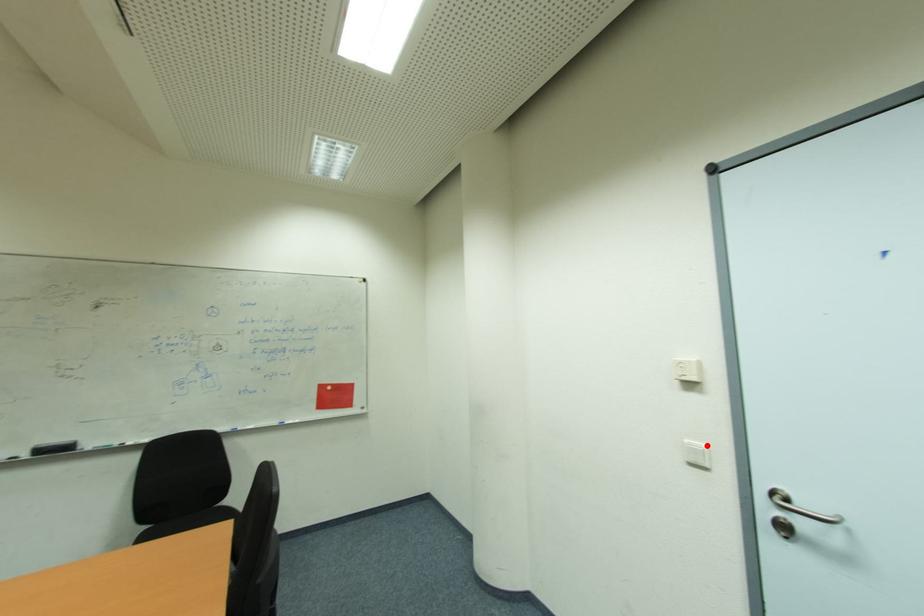
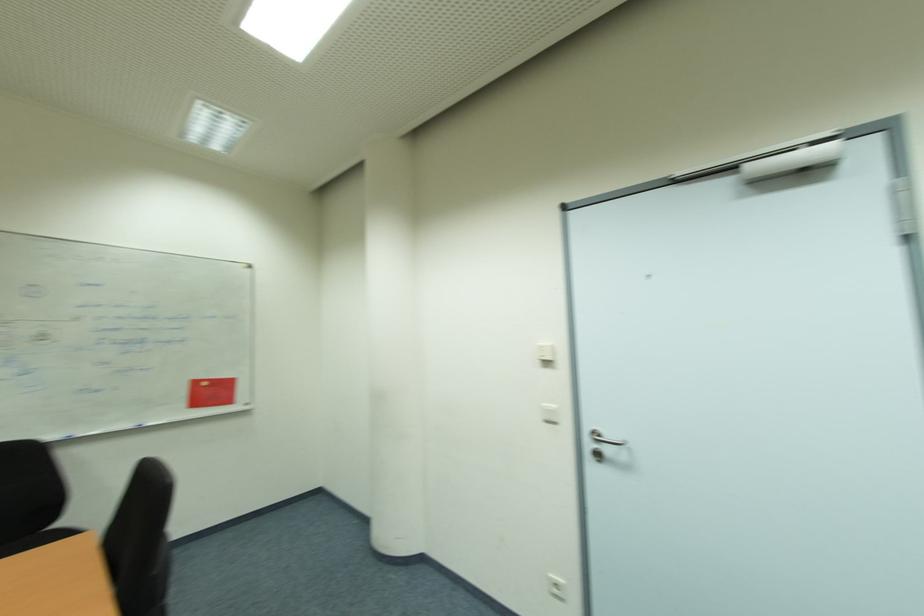
Question: I am providing you with two images of the same scene from different viewpoints. In image1, a red point is highlighted. Considering the same 3D point in image2, which of the following is correct?

Choices:
 (A) It is closer
 (B) It is farther

Answer: (B)